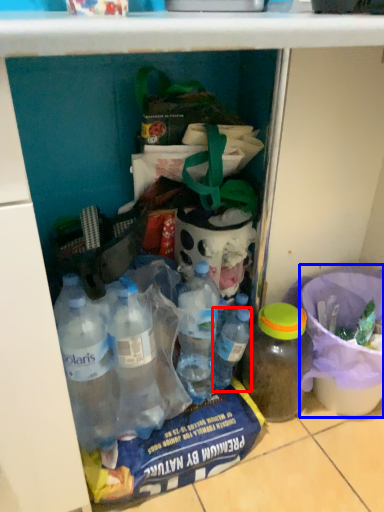
Question: Which object is closer to the camera taking this photo, bottle (highlighted by a red box) or bucket (highlighted by a blue box)?

Choices:
 (A) bottle
 (B) bucket

Answer: (B)